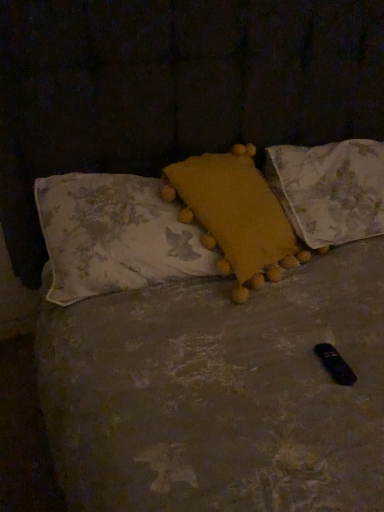
Question: Is yellow fabric pillow at upper right, arranged as the 3th pillow when viewed from the left, not near yellow fuzzy pillow at center, the second pillow in the left-to-right sequence?

Choices:
 (A) yes
 (B) no

Answer: (B)

Question: Considering the relative sizes of yellow fabric pillow at upper right, arranged as the 3th pillow when viewed from the left, and yellow fuzzy pillow at center, marked as the second pillow in a right-to-left arrangement, in the image provided, is yellow fabric pillow at upper right, arranged as the 3th pillow when viewed from the left, thinner than yellow fuzzy pillow at center, marked as the second pillow in a right-to-left arrangement,?

Choices:
 (A) yes
 (B) no

Answer: (B)

Question: From the image's perspective, is yellow fabric pillow at upper right, arranged as the 3th pillow when viewed from the left, below yellow fuzzy pillow at center, the second pillow in the left-to-right sequence?

Choices:
 (A) no
 (B) yes

Answer: (A)

Question: Is yellow fabric pillow at upper right, which is the first pillow from right to left, wider than yellow fuzzy pillow at center, the second pillow in the left-to-right sequence?

Choices:
 (A) yes
 (B) no

Answer: (A)

Question: Does yellow fabric pillow at upper right, arranged as the 3th pillow when viewed from the left, have a greater height compared to yellow fuzzy pillow at center, the second pillow in the left-to-right sequence?

Choices:
 (A) yes
 (B) no

Answer: (B)

Question: Is yellow fabric pillow at upper right, which is the first pillow from right to left, bigger or smaller than yellow fuzzy pillow at center, marked as the second pillow in a right-to-left arrangement?

Choices:
 (A) big
 (B) small

Answer: (A)

Question: Do you think yellow fabric pillow at upper right, which is the first pillow from right to left, is within yellow fuzzy pillow at center, marked as the second pillow in a right-to-left arrangement, or outside of it?

Choices:
 (A) inside
 (B) outside

Answer: (B)

Question: Would you say yellow fabric pillow at upper right, which is the first pillow from right to left, is to the left or to the right of yellow fuzzy pillow at center, marked as the second pillow in a right-to-left arrangement, in the picture?

Choices:
 (A) left
 (B) right

Answer: (B)

Question: Is yellow fabric pillow at upper right, arranged as the 3th pillow when viewed from the left, wider or thinner than yellow fuzzy pillow at center, the second pillow in the left-to-right sequence?

Choices:
 (A) wide
 (B) thin

Answer: (A)

Question: From the image's perspective, relative to fluffy yellow pillow at center, which is the 3th pillow from right to left, is yellow fabric pillow at upper right, which is the first pillow from right to left, above or below?

Choices:
 (A) below
 (B) above

Answer: (B)

Question: From a real-world perspective, is yellow fabric pillow at upper right, arranged as the 3th pillow when viewed from the left, physically located above or below fluffy yellow pillow at center, which is the 3th pillow from right to left?

Choices:
 (A) below
 (B) above

Answer: (A)

Question: In terms of width, does yellow fabric pillow at upper right, which is the first pillow from right to left, look wider or thinner when compared to fluffy yellow pillow at center, which is the first pillow from left to right?

Choices:
 (A) wide
 (B) thin

Answer: (A)

Question: Is yellow fabric pillow at upper right, arranged as the 3th pillow when viewed from the left, to the left or to the right of fluffy yellow pillow at center, which is the 3th pillow from right to left, in the image?

Choices:
 (A) left
 (B) right

Answer: (B)

Question: Does point (62, 193) appear closer or farther from the camera than point (206, 161)?

Choices:
 (A) farther
 (B) closer

Answer: (B)

Question: From a real-world perspective, relative to yellow fuzzy pillow at center, marked as the second pillow in a right-to-left arrangement, is fluffy yellow pillow at center, which is the 3th pillow from right to left, vertically above or below?

Choices:
 (A) above
 (B) below

Answer: (B)